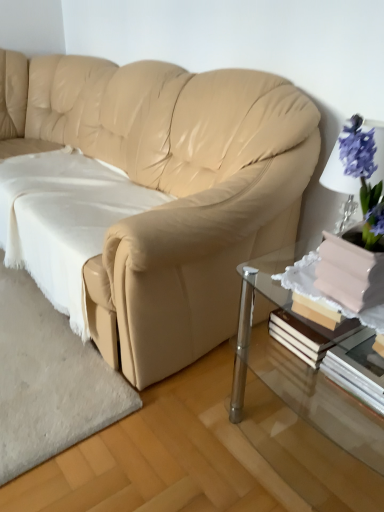
In order to click on vacant space situated on the left part of clear glass table at lower right in this screenshot , I will do `click(195, 432)`.